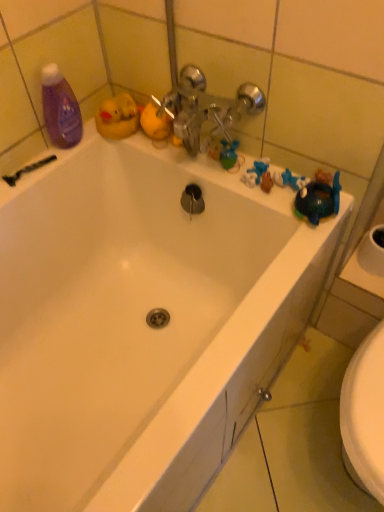
The image size is (384, 512). Describe the element at coordinates (27, 170) in the screenshot. I see `black plastic razor at upper left` at that location.

Locate an element on the screen. This screenshot has height=512, width=384. black plastic razor at upper left is located at coordinates (27, 170).

The image size is (384, 512). Describe the element at coordinates (60, 108) in the screenshot. I see `purple glossy bottle at upper left` at that location.

Find the location of a particular element. Image resolution: width=384 pixels, height=512 pixels. purple glossy bottle at upper left is located at coordinates (60, 108).

Find the location of a particular element. The width and height of the screenshot is (384, 512). black plastic razor at upper left is located at coordinates (27, 170).

Which is more to the left, black plastic razor at upper left or purple glossy bottle at upper left?

black plastic razor at upper left is more to the left.

Which object is more forward, black plastic razor at upper left or purple glossy bottle at upper left?

Positioned in front is purple glossy bottle at upper left.

Considering the points (45, 159) and (44, 66), which point is behind, point (45, 159) or point (44, 66)?

The point (45, 159) is farther.

From the image's perspective, is black plastic razor at upper left located above or below purple glossy bottle at upper left?

Based on their image positions, black plastic razor at upper left is located beneath purple glossy bottle at upper left.

From a real-world perspective, is black plastic razor at upper left located higher than purple glossy bottle at upper left?

Actually, black plastic razor at upper left is physically below purple glossy bottle at upper left in the real world.

Considering the sizes of black plastic razor at upper left and purple glossy bottle at upper left in the image, is black plastic razor at upper left wider or thinner than purple glossy bottle at upper left?

Considering their sizes, black plastic razor at upper left looks slimmer than purple glossy bottle at upper left.

Is black plastic razor at upper left shorter than purple glossy bottle at upper left?

Yes, black plastic razor at upper left is shorter than purple glossy bottle at upper left.

Considering the sizes of black plastic razor at upper left and purple glossy bottle at upper left in the image, is black plastic razor at upper left bigger or smaller than purple glossy bottle at upper left?

Considering their sizes, black plastic razor at upper left takes up less space than purple glossy bottle at upper left.

Is purple glossy bottle at upper left a part of black plastic razor at upper left?

No.

Is black plastic razor at upper left touching purple glossy bottle at upper left?

No, black plastic razor at upper left is not touching purple glossy bottle at upper left.

Does black plastic razor at upper left turn towards purple glossy bottle at upper left?

No, black plastic razor at upper left is not oriented towards purple glossy bottle at upper left.

Consider the image. Can you tell me how much black plastic razor at upper left and purple glossy bottle at upper left differ in facing direction?

There is a 0.000204-degree angle between the facing directions of black plastic razor at upper left and purple glossy bottle at upper left.

The width and height of the screenshot is (384, 512). I want to click on cleaning product in front of the black plastic razor at upper left, so 60,108.

Which is more to the right, purple glossy bottle at upper left or black plastic razor at upper left?

purple glossy bottle at upper left.

Which object is more forward, purple glossy bottle at upper left or black plastic razor at upper left?

purple glossy bottle at upper left is closer to the camera.

Does point (46, 110) lie in front of point (27, 170)?

Yes, it is in front of point (27, 170).

From the image's perspective, is purple glossy bottle at upper left located above or below black plastic razor at upper left?

From the image's perspective, purple glossy bottle at upper left appears above black plastic razor at upper left.

From a real-world perspective, is purple glossy bottle at upper left physically located above or below black plastic razor at upper left?

From a real-world perspective, purple glossy bottle at upper left is physically above black plastic razor at upper left.

Which object is wider, purple glossy bottle at upper left or black plastic razor at upper left?

purple glossy bottle at upper left is wider.

Which of these two, purple glossy bottle at upper left or black plastic razor at upper left, stands shorter?

Standing shorter between the two is black plastic razor at upper left.

Is purple glossy bottle at upper left bigger or smaller than black plastic razor at upper left?

purple glossy bottle at upper left is bigger than black plastic razor at upper left.

Would you say black plastic razor at upper left is part of purple glossy bottle at upper left's contents?

Definitely not — black plastic razor at upper left is not inside purple glossy bottle at upper left.

From the picture: Is purple glossy bottle at upper left far away from black plastic razor at upper left?

No.

Could you tell me if purple glossy bottle at upper left is facing black plastic razor at upper left?

No.

How many degrees apart are the facing directions of purple glossy bottle at upper left and black plastic razor at upper left?

The angle between the facing direction of purple glossy bottle at upper left and the facing direction of black plastic razor at upper left is 0.000204 degrees.

The width and height of the screenshot is (384, 512). What are the coordinates of `shower below the purple glossy bottle at upper left (from a real-world perspective)` in the screenshot? It's located at (27, 170).

Find the location of a particular element. Image resolution: width=384 pixels, height=512 pixels. shower below the purple glossy bottle at upper left (from a real-world perspective) is located at coordinates (27, 170).

I want to click on cleaning product positioned vertically above the black plastic razor at upper left (from a real-world perspective), so click(60, 108).